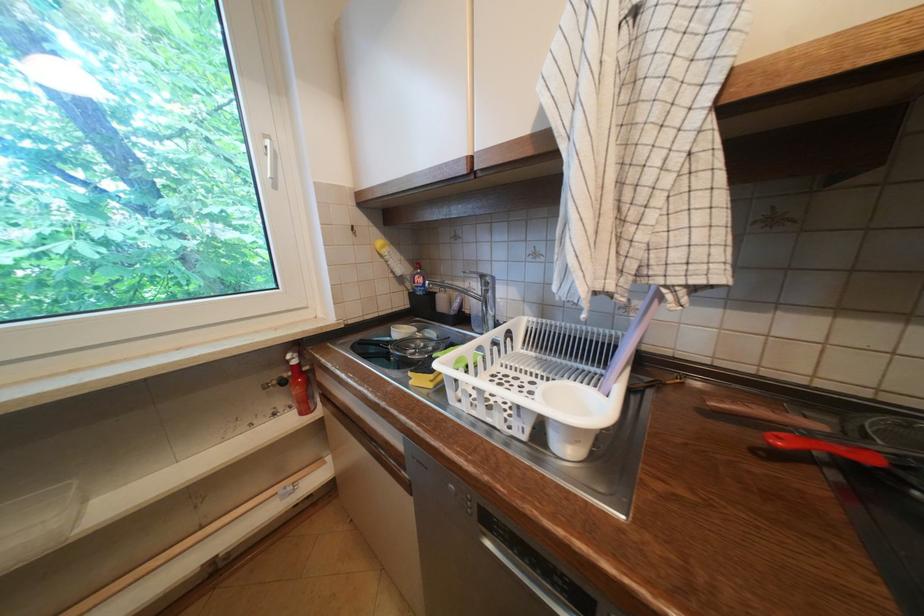
Where would you grasp the wooden knife handle? Please return your answer as a coordinate pair (x, y).

(824, 448)